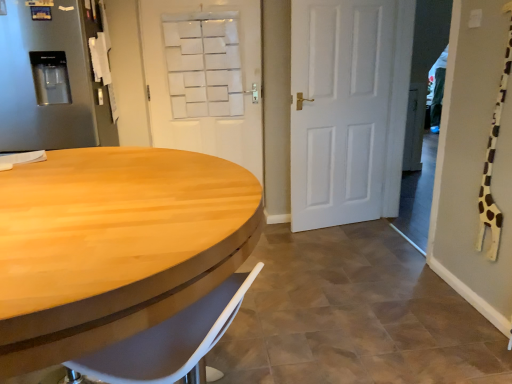
Question: Is point (184, 0) positioned closer to the camera than point (17, 317)?

Choices:
 (A) closer
 (B) farther

Answer: (B)

Question: Is white matte door at upper center, which is the 1th door from left to right, to the left or to the right of light wood/wooden table at left in the image?

Choices:
 (A) left
 (B) right

Answer: (B)

Question: Estimate the real-world distances between objects in this image. Which object is closer to the satin silver refrigerator at left?

Choices:
 (A) white matte door at upper center, which is the 1th door from left to right
 (B) light wood/wooden table at left
 (C) white matte door at center, placed as the second door when sorted from left to right

Answer: (A)

Question: Estimate the real-world distances between objects in this image. Which object is closer to the white matte door at center, which is the first door in right-to-left order?

Choices:
 (A) light wood/wooden table at left
 (B) white matte door at upper center, which is counted as the second door, starting from the right
 (C) satin silver refrigerator at left

Answer: (B)